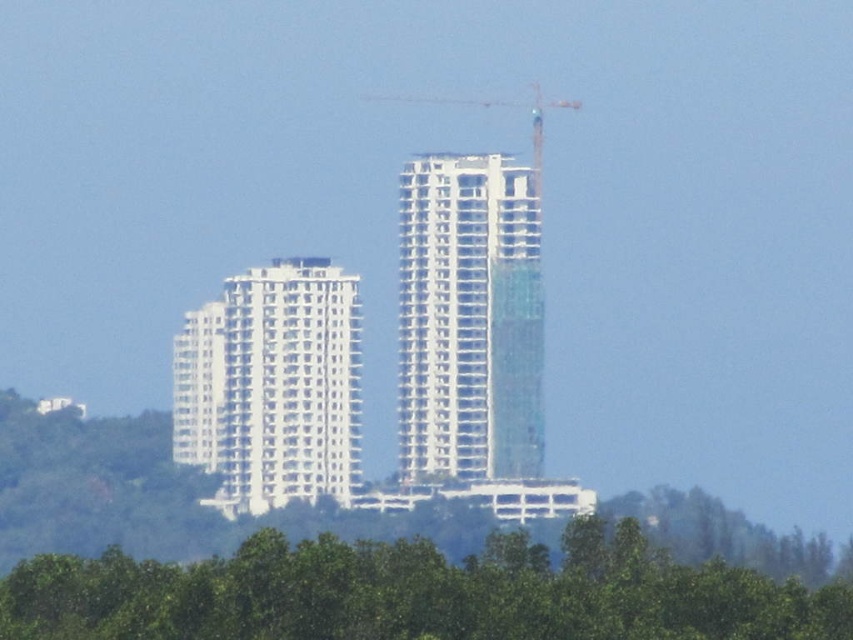
Question: Which object is farther from the camera taking this photo?

Choices:
 (A) green leafy trees at lower center
 (B) white glassy building at center

Answer: (A)

Question: Which is nearer to the white textured building at center?

Choices:
 (A) white metallic crane at center
 (B) green leafy trees at lower center
 (C) white glassy building at center

Answer: (C)

Question: Can you confirm if green leafy trees at lower center is bigger than white textured building at center?

Choices:
 (A) no
 (B) yes

Answer: (B)

Question: Considering the real-world distances, which object is closest to the white textured building at center?

Choices:
 (A) white glassy building at center
 (B) green leafy trees at lower center

Answer: (A)

Question: Does green leafy trees at lower center have a greater width compared to white glassy building at center?

Choices:
 (A) yes
 (B) no

Answer: (A)

Question: Is green leafy trees at lower center below white metallic crane at center?

Choices:
 (A) yes
 (B) no

Answer: (A)